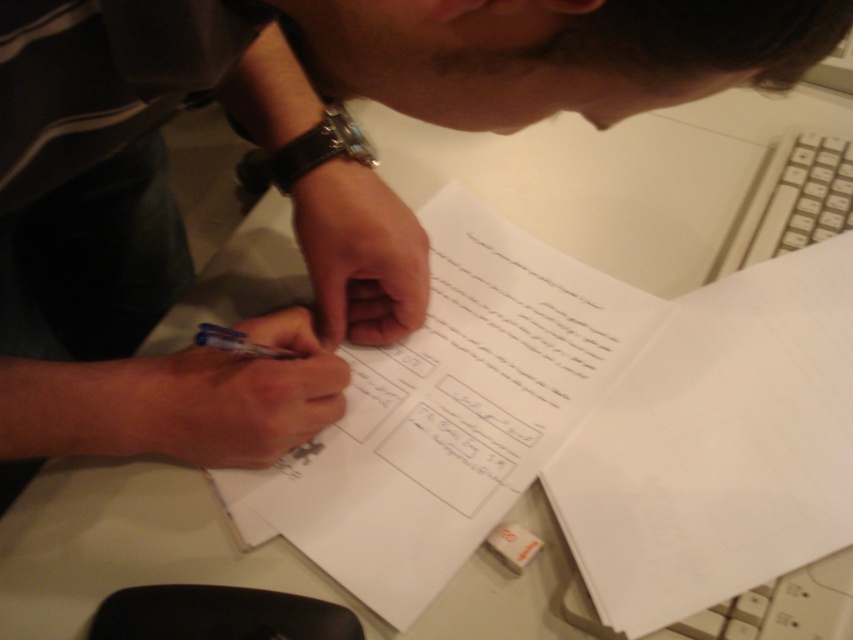
You are a student who needs to choose a pen to write with. You have two options on the desk in front of you, a matte black pen at center and a blue plastic pen at center. Which pen is taller?

The matte black pen at center is much taller than the blue plastic pen at center.

You are a student who needs to write on the white paper at center. Where should you place the blue plastic pen at center relative to the paper to write comfortably?

The white paper at center is to the right of the blue plastic pen at center, so to write comfortably, you should move the blue plastic pen at center to the left side of the white paper at center.